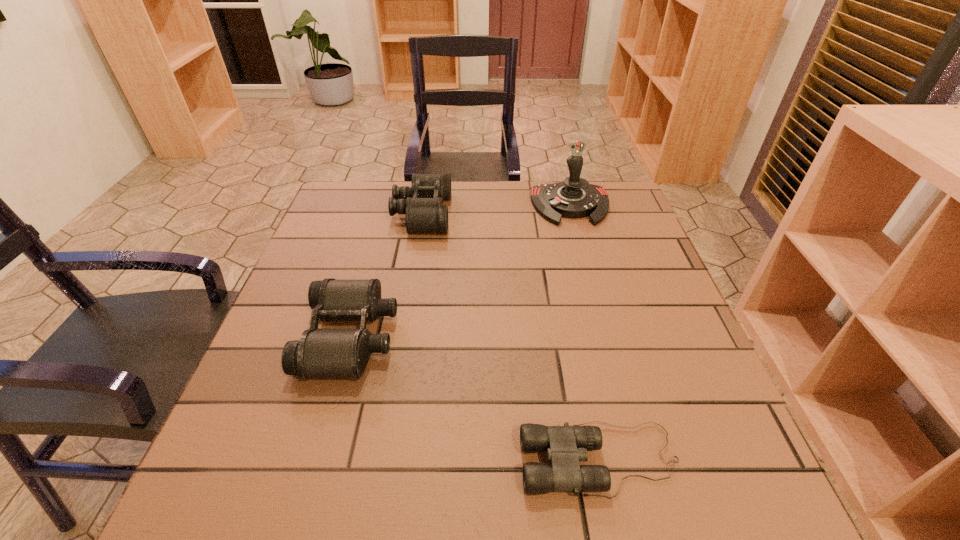
Image resolution: width=960 pixels, height=540 pixels. What are the coordinates of `joystick` in the screenshot? It's located at (574, 198).

Locate an element on the screen. This screenshot has width=960, height=540. the farthest binoculars is located at coordinates (421, 203).

Where is `the second nearest object`? This screenshot has width=960, height=540. the second nearest object is located at coordinates (320, 353).

Locate an element on the screen. the shortest object is located at coordinates (566, 446).

Locate an element on the screen. the nearest object is located at coordinates (566, 446).

Find the location of `vacant region located 0.190m on the handle side of the joystick`. vacant region located 0.190m on the handle side of the joystick is located at coordinates (588, 272).

This screenshot has width=960, height=540. What are the coordinates of `vacant space situated 0.210m at the eyepieces of the farthest binoculars` in the screenshot? It's located at (522, 214).

Identify the location of free point located 0.070m through the eyepieces of the second nearest binoculars. The image size is (960, 540). (427, 336).

You are a GUI agent. You are given a task and a screenshot of the screen. Output one action in this format:
    pyautogui.click(x=<x>, y=<y>)
    Task: Click on the free space located 0.200m at the eyepiece of the nearest binoculars
    This screenshot has height=540, width=960.
    Given the screenshot: What is the action you would take?
    pyautogui.click(x=400, y=460)

Identify the location of free space located at the eyepiece of the nearest binoculars. This screenshot has height=540, width=960. (467, 460).